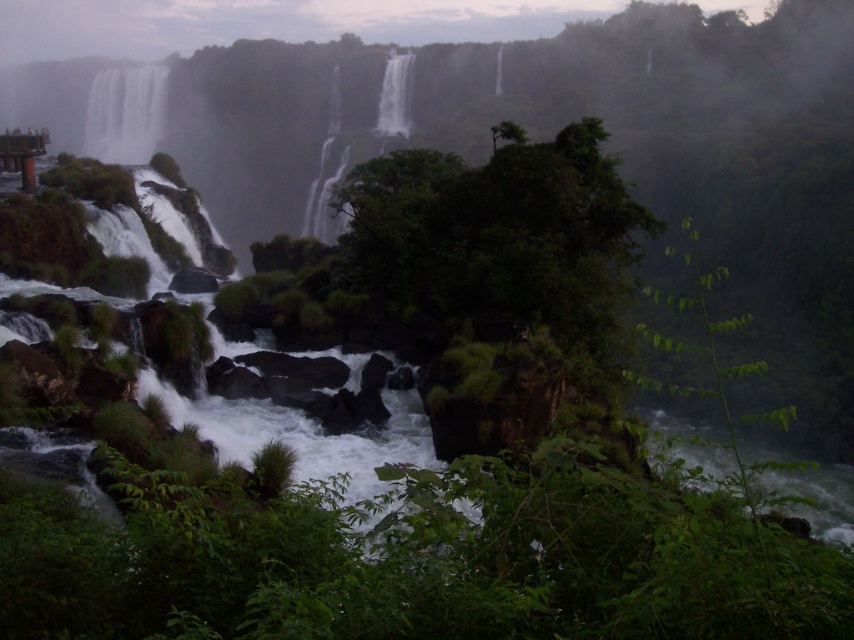
Question: Observing the image, what is the correct spatial positioning of white misty waterfall at center in reference to white frothy water at center?

Choices:
 (A) right
 (B) left

Answer: (B)

Question: Observing the image, what is the correct spatial positioning of white misty waterfall at left in reference to white frothy water at center?

Choices:
 (A) below
 (B) above

Answer: (B)

Question: Estimate the real-world distances between objects in this image. Which object is closer to the white frothy water at center?

Choices:
 (A) white misty waterfall at left
 (B) white misty waterfall at center

Answer: (B)

Question: Is white misty waterfall at left below white misty waterfall at center?

Choices:
 (A) yes
 (B) no

Answer: (B)

Question: Which point is farther from the camera taking this photo?

Choices:
 (A) (309, 218)
 (B) (390, 120)

Answer: (B)

Question: Among these points, which one is nearest to the camera?

Choices:
 (A) (407, 64)
 (B) (334, 170)

Answer: (B)